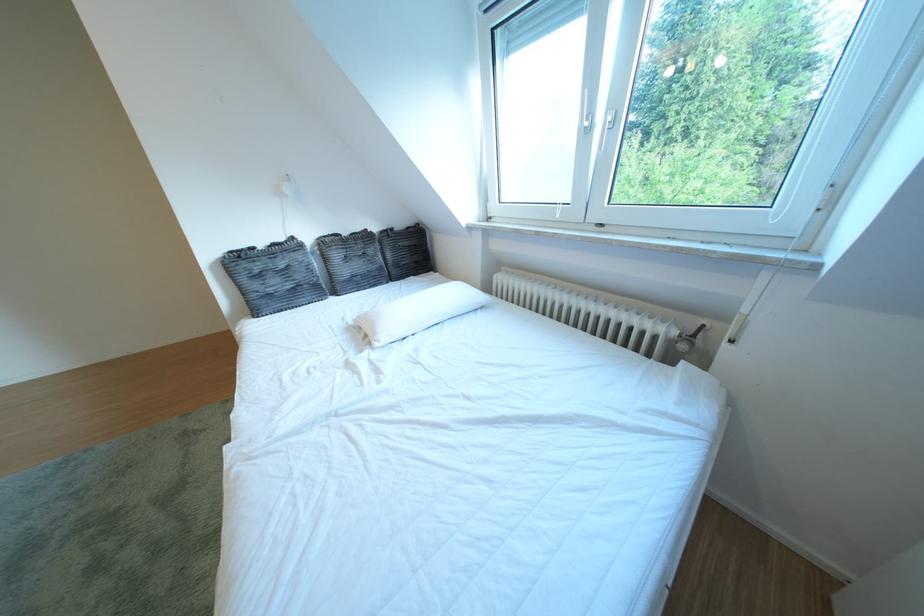
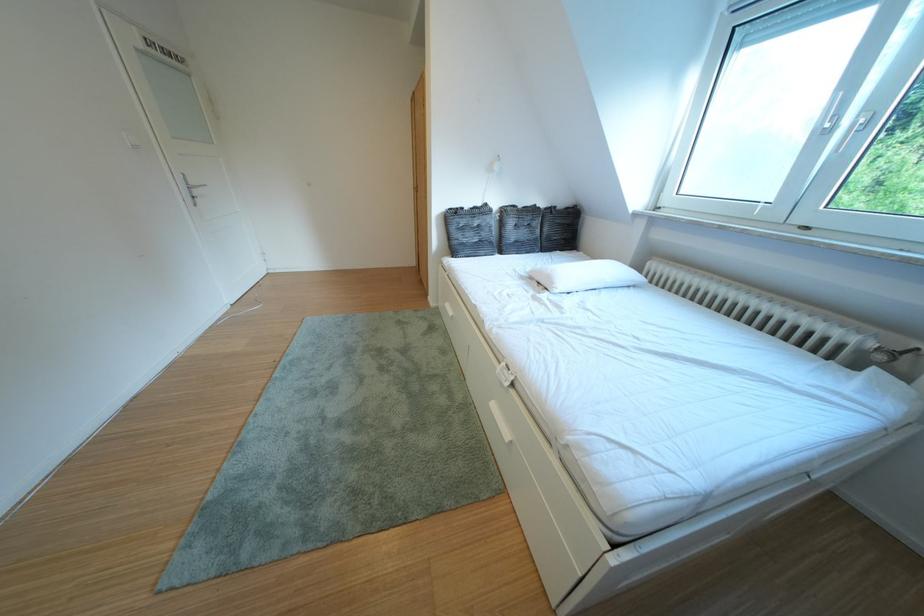
Locate, in the second image, the point that corresponds to point (697, 352) in the first image.

(893, 363)